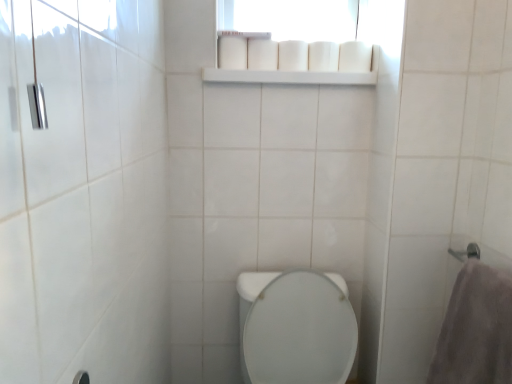
Question: Is white matte toilet paper at upper center, which is the 3th toilet paper in right-to-left order, surrounding white glossy toilet at center?

Choices:
 (A) yes
 (B) no

Answer: (B)

Question: Is white matte toilet paper at upper center, which appears as the 3th toilet paper when viewed from the left, oriented towards white glossy toilet at center?

Choices:
 (A) no
 (B) yes

Answer: (A)

Question: From a real-world perspective, is white matte toilet paper at upper center, which is the 3th toilet paper in right-to-left order, below white glossy toilet at center?

Choices:
 (A) no
 (B) yes

Answer: (A)

Question: Considering the relative sizes of white matte toilet paper at upper center, which is the 3th toilet paper in right-to-left order, and white glossy toilet at center in the image provided, is white matte toilet paper at upper center, which is the 3th toilet paper in right-to-left order, taller than white glossy toilet at center?

Choices:
 (A) yes
 (B) no

Answer: (B)

Question: Considering the relative sizes of white matte toilet paper at upper center, which appears as the 3th toilet paper when viewed from the left, and white glossy toilet at center in the image provided, is white matte toilet paper at upper center, which appears as the 3th toilet paper when viewed from the left, wider than white glossy toilet at center?

Choices:
 (A) yes
 (B) no

Answer: (B)

Question: From a real-world perspective, is white matte toilet paper at upper center, which appears as the 3th toilet paper when viewed from the left, on top of white glossy toilet at center?

Choices:
 (A) yes
 (B) no

Answer: (A)

Question: Does white matte toilet paper at upper center, marked as the 5th toilet paper in a left-to-right arrangement, have a larger size compared to white matte toilet paper at upper center, which is counted as the fourth toilet paper, starting from the left?

Choices:
 (A) yes
 (B) no

Answer: (A)

Question: Are white matte toilet paper at upper center, marked as the 5th toilet paper in a left-to-right arrangement, and white matte toilet paper at upper center, which is counted as the fourth toilet paper, starting from the left, far apart?

Choices:
 (A) no
 (B) yes

Answer: (A)

Question: From a real-world perspective, is white matte toilet paper at upper center, the first toilet paper viewed from the right, physically above white matte toilet paper at upper center, acting as the 2th toilet paper starting from the right?

Choices:
 (A) yes
 (B) no

Answer: (B)

Question: Is the depth of white matte toilet paper at upper center, marked as the 5th toilet paper in a left-to-right arrangement, greater than that of white matte toilet paper at upper center, acting as the 2th toilet paper starting from the right?

Choices:
 (A) no
 (B) yes

Answer: (A)

Question: Is white matte toilet paper at upper center, the first toilet paper viewed from the right, next to white matte toilet paper at upper center, which is counted as the fourth toilet paper, starting from the left?

Choices:
 (A) yes
 (B) no

Answer: (A)

Question: From a real-world perspective, is white matte toilet paper at upper center, the first toilet paper viewed from the right, physically below white matte toilet paper at upper center, acting as the 2th toilet paper starting from the right?

Choices:
 (A) no
 (B) yes

Answer: (B)

Question: Does white matte toilet paper at upper center, acting as the 2th toilet paper starting from the right, turn towards white matte toilet paper at upper center, marked as the fourth toilet paper in a right-to-left arrangement?

Choices:
 (A) no
 (B) yes

Answer: (A)